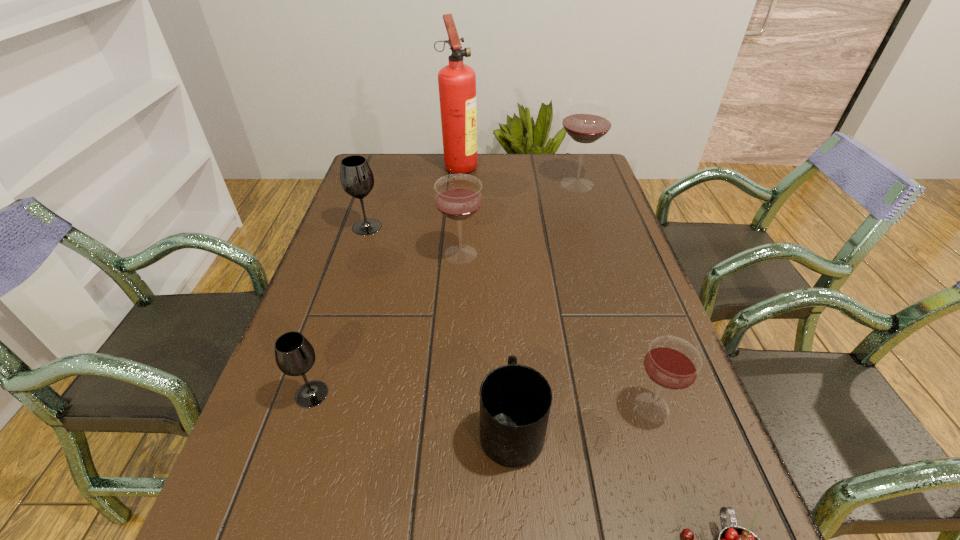
Where is `the tallest object`? Image resolution: width=960 pixels, height=540 pixels. the tallest object is located at coordinates (457, 82).

This screenshot has height=540, width=960. Identify the location of fire extinguisher. (457, 82).

Locate an element on the screen. The width and height of the screenshot is (960, 540). the biggest red wineglass is located at coordinates (587, 119).

Locate an element on the screen. the farthest wineglass is located at coordinates tap(587, 119).

At what (x,y) coordinates should I click in order to perform the action: click on the third wineglass from right to left. Please return your answer as a coordinate pair (x, y). Image resolution: width=960 pixels, height=540 pixels. Looking at the image, I should click on (458, 197).

At what (x,y) coordinates should I click in order to perform the action: click on the second smallest red wineglass. Please return your answer as a coordinate pair (x, y). Looking at the image, I should click on (458, 197).

Locate an element on the screen. Image resolution: width=960 pixels, height=540 pixels. the sixth nearest object is located at coordinates (356, 177).

Where is `the bigger gray wineglass`? the bigger gray wineglass is located at coordinates (356, 177).

You are a GUI agent. You are given a task and a screenshot of the screen. Output one action in this format:
    pyautogui.click(x=<x>, y=<y>)
    Task: Click on the smallest red wineglass
    
    Given the screenshot: What is the action you would take?
    pyautogui.click(x=672, y=363)

Locate an element on the screen. the smaller gray wineglass is located at coordinates (295, 356).